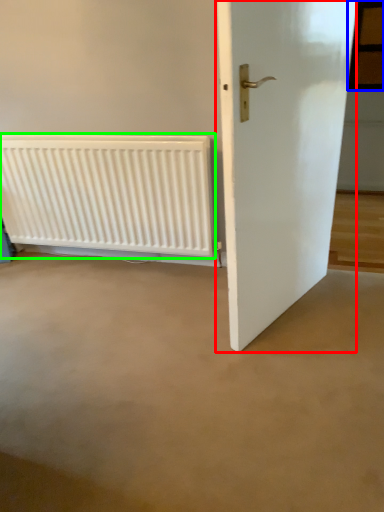
Question: Which object is positioned closest to door (highlighted by a red box)? Select from window (highlighted by a blue box) and radiator (highlighted by a green box).

Choices:
 (A) window
 (B) radiator

Answer: (B)